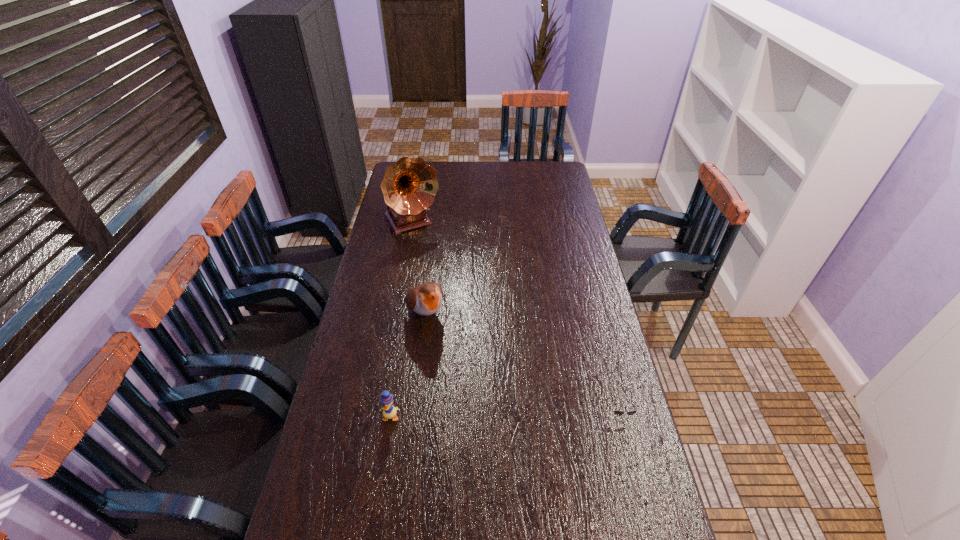
Locate an element on the screen. vacant space located at the face of the second farthest object is located at coordinates (460, 380).

You are a GUI agent. You are given a task and a screenshot of the screen. Output one action in this format:
    pyautogui.click(x=<x>, y=<y>)
    Task: Click on the vacant space located 0.240m at the face of the second farthest object
    The width and height of the screenshot is (960, 540).
    Given the screenshot: What is the action you would take?
    pyautogui.click(x=464, y=387)

Where is `vacant space located on the horn of the farthest object`? The image size is (960, 540). vacant space located on the horn of the farthest object is located at coordinates (442, 271).

I want to click on vacant area located 0.070m on the horn of the farthest object, so click(x=428, y=248).

I want to click on vacant position located on the horn of the farthest object, so click(451, 287).

Identify the location of duckling located at the left edge. The width and height of the screenshot is (960, 540). click(389, 411).

This screenshot has height=540, width=960. I want to click on phonograph_record that is at the left edge, so click(409, 186).

The height and width of the screenshot is (540, 960). I want to click on object at the right edge, so click(x=617, y=412).

In the image, there is a desktop. Where is `free space at the far edge`? free space at the far edge is located at coordinates (481, 166).

Where is `free space at the near edge of the desktop`? The width and height of the screenshot is (960, 540). free space at the near edge of the desktop is located at coordinates pyautogui.click(x=370, y=523).